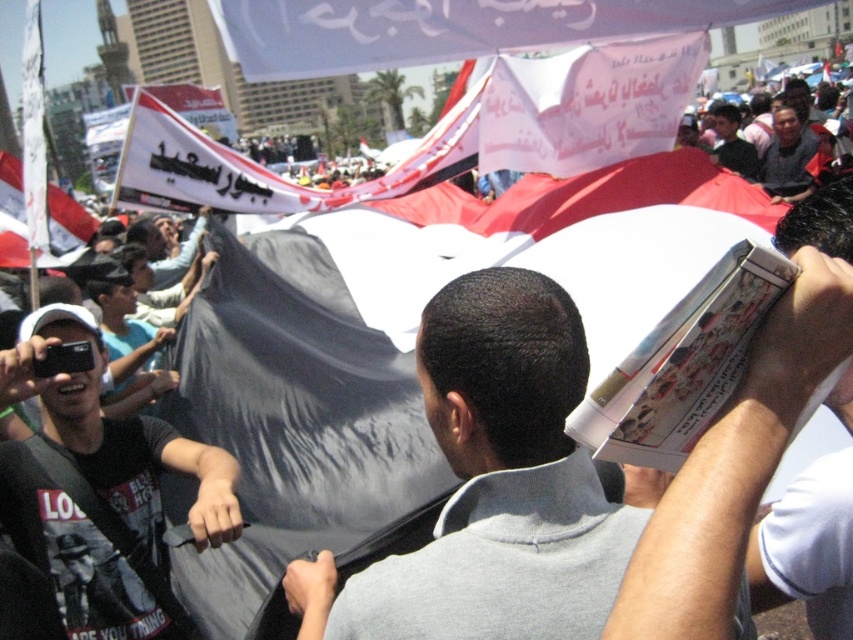
Between gray matte book at center and white paper book at center, which one has less height?

Standing shorter between the two is gray matte book at center.

Is point (468, 460) in front of point (750, 547)?

Yes, it is in front of point (750, 547).

Which is in front, point (578, 452) or point (741, 518)?

Point (741, 518) is in front.

Identify the location of gray matte book at center. The image size is (853, 640). (492, 484).

Does dark gray fabric at upper right appear over dark gray fabric at upper center?

Incorrect, dark gray fabric at upper right is not positioned above dark gray fabric at upper center.

Can you confirm if dark gray fabric at upper right is bigger than dark gray fabric at upper center?

Yes, dark gray fabric at upper right is bigger than dark gray fabric at upper center.

Based on the photo, who is more forward, (798, 122) or (712, 157)?

Positioned in front is point (712, 157).

Locate an element on the screen. The height and width of the screenshot is (640, 853). dark gray fabric at upper right is located at coordinates (787, 157).

Is point (26, 362) behind point (543, 116)?

That is False.

Does black matte t-shirt at left have a lesser width compared to white paper banner at center?

Indeed, black matte t-shirt at left has a lesser width compared to white paper banner at center.

Does point (65, 536) come in front of point (515, 56)?

Yes, it is in front of point (515, 56).

At what (x,y) coordinates should I click in order to perform the action: click on black matte t-shirt at left. Please return your answer as a coordinate pair (x, y). The image size is (853, 640). Looking at the image, I should click on point(100,492).